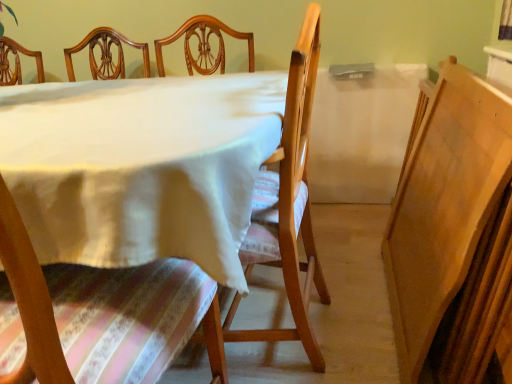
Question: Does point (140, 317) appear closer or farther from the camera than point (0, 142)?

Choices:
 (A) farther
 (B) closer

Answer: (B)

Question: From the image's perspective, is wooden chair at center, positioned as the second chair in right-to-left order, located above or below white cloth at center?

Choices:
 (A) above
 (B) below

Answer: (B)

Question: Based on their relative distances, which object is nearer to the wooden chair at center, positioned as the second chair in right-to-left order?

Choices:
 (A) white cloth at center
 (B) wooden chair at center, acting as the first chair starting from the right

Answer: (A)

Question: Considering the real-world distances, which object is closest to the wooden chair at center, acting as the first chair starting from the right?

Choices:
 (A) white cloth at center
 (B) wooden chair at center, positioned as the second chair in right-to-left order

Answer: (A)